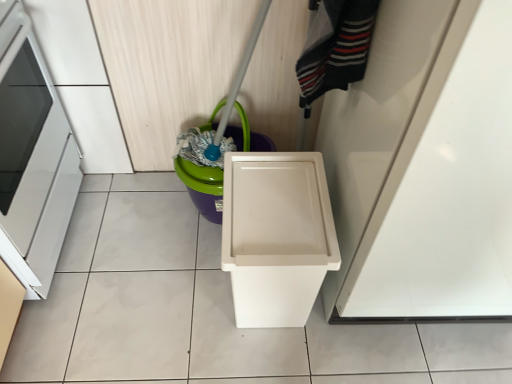
Identify the location of striped wool sweater at upper right. This screenshot has width=512, height=384. (335, 47).

What do you see at coordinates (34, 161) in the screenshot? I see `white glossy oven at left` at bounding box center [34, 161].

You are a GUI agent. You are given a task and a screenshot of the screen. Output one action in this format:
    pyautogui.click(x=<x>, y=<y>)
    Task: Click on the white glossy door at upper right
    This screenshot has width=512, height=384.
    Given the screenshot: What is the action you would take?
    pyautogui.click(x=424, y=166)

Is white glossy oven at left aimed at white glossy door at upper right?

Yes.

Considering the relative sizes of white glossy oven at left and white glossy door at upper right in the image provided, is white glossy oven at left shorter than white glossy door at upper right?

Indeed, white glossy oven at left has a lesser height compared to white glossy door at upper right.

I want to click on door lying above the white glossy oven at left (from the image's perspective), so click(424, 166).

Considering the relative sizes of white glossy oven at left and white plastic waste container at center in the image provided, is white glossy oven at left taller than white plastic waste container at center?

Correct, white glossy oven at left is much taller as white plastic waste container at center.

What's the angular difference between white glossy oven at left and white plastic waste container at center's facing directions?

The angular difference between white glossy oven at left and white plastic waste container at center is 90 degrees.

From a real-world perspective, is white glossy oven at left above or below white plastic waste container at center?

white glossy oven at left is above white plastic waste container at center.

From the image's perspective, is white glossy oven at left beneath white plastic waste container at center?

No, from the image's perspective, white glossy oven at left is not beneath white plastic waste container at center.

The height and width of the screenshot is (384, 512). I want to click on oven below the striped wool sweater at upper right (from the image's perspective), so click(x=34, y=161).

Is striped wool sweater at upper right aimed at white glossy oven at left?

No, striped wool sweater at upper right is not oriented towards white glossy oven at left.

Which object is further away from the camera taking this photo, striped wool sweater at upper right or white glossy oven at left?

white glossy oven at left.

Which of these two, striped wool sweater at upper right or white glossy oven at left, is wider?

white glossy oven at left.

From the image's perspective, is white plastic waste container at center beneath white glossy oven at left?

Correct, white plastic waste container at center appears lower than white glossy oven at left in the image.

In terms of width, does white plastic waste container at center look wider or thinner when compared to white glossy oven at left?

In the image, white plastic waste container at center appears to be more narrow than white glossy oven at left.

Is white plastic waste container at center oriented away from white glossy oven at left?

No, white plastic waste container at center is not facing the opposite direction of white glossy oven at left.

Which of these two, striped wool sweater at upper right or matte green plastic bucket at center, stands taller?

matte green plastic bucket at center is taller.

Could you tell me if striped wool sweater at upper right is turned towards matte green plastic bucket at center?

No, striped wool sweater at upper right is not turned towards matte green plastic bucket at center.

The height and width of the screenshot is (384, 512). Identify the location of clothing above the matte green plastic bucket at center (from a real-world perspective). (335, 47).

Between striped wool sweater at upper right and matte green plastic bucket at center, which one is positioned behind?

Positioned behind is matte green plastic bucket at center.

Does striped wool sweater at upper right turn towards white plastic waste container at center?

No, striped wool sweater at upper right is not facing towards white plastic waste container at center.

Which is behind, striped wool sweater at upper right or white plastic waste container at center?

Positioned behind is white plastic waste container at center.

From the image's perspective, is striped wool sweater at upper right located above or below white plastic waste container at center?

From the image's perspective, striped wool sweater at upper right appears above white plastic waste container at center.

Are striped wool sweater at upper right and white plastic waste container at center making contact?

striped wool sweater at upper right and white plastic waste container at center are clearly separated.

Is matte green plastic bucket at center outside of white glossy door at upper right?

matte green plastic bucket at center lies outside white glossy door at upper right's area.

From the image's perspective, is matte green plastic bucket at center under white glossy door at upper right?

Correct, matte green plastic bucket at center appears lower than white glossy door at upper right in the image.

Can you tell me how much matte green plastic bucket at center and white glossy door at upper right differ in facing direction?

The angular difference between matte green plastic bucket at center and white glossy door at upper right is 1.46e-05 degrees.

Which is less distant, (206, 184) or (480, 158)?

Point (206, 184).

This screenshot has width=512, height=384. In order to click on door above the white glossy oven at left (from the image's perspective) in this screenshot , I will do `click(424, 166)`.

Identify the location of oven on the left of white plastic waste container at center. (34, 161).

Considering their positions, is white glossy door at upper right positioned further to matte green plastic bucket at center than white plastic waste container at center?

white glossy door at upper right is further to matte green plastic bucket at center.

From the image, which object appears to be farther from white glossy oven at left, matte green plastic bucket at center or white plastic waste container at center?

white plastic waste container at center is positioned further to the anchor white glossy oven at left.

Looking at the image, which one is located further to white glossy door at upper right, white plastic waste container at center or striped wool sweater at upper right?

striped wool sweater at upper right lies further to white glossy door at upper right than the other object.

Estimate the real-world distances between objects in this image. Which object is closer to white plastic waste container at center, matte green plastic bucket at center or white glossy door at upper right?

white glossy door at upper right.

Estimate the real-world distances between objects in this image. Which object is further from white glossy door at upper right, white glossy oven at left or matte green plastic bucket at center?

white glossy oven at left is positioned further to the anchor white glossy door at upper right.

Considering their positions, is white plastic waste container at center positioned further to matte green plastic bucket at center than striped wool sweater at upper right?

striped wool sweater at upper right lies further to matte green plastic bucket at center than the other object.

Based on their spatial positions, is white glossy door at upper right or white plastic waste container at center further from white glossy oven at left?

Based on the image, white glossy door at upper right appears to be further to white glossy oven at left.

Which object lies further to the anchor point striped wool sweater at upper right, white glossy door at upper right or white glossy oven at left?

white glossy oven at left lies further to striped wool sweater at upper right than the other object.

Where is `potty that lies between striped wool sweater at upper right and white plastic waste container at center from top to bottom`? This screenshot has height=384, width=512. potty that lies between striped wool sweater at upper right and white plastic waste container at center from top to bottom is located at coordinates (202, 187).

This screenshot has height=384, width=512. I want to click on potty between white glossy oven at left and white glossy door at upper right from left to right, so click(x=202, y=187).

The image size is (512, 384). What are the coordinates of `clothing between white plastic waste container at center and white glossy door at upper right` in the screenshot? It's located at (335, 47).

The width and height of the screenshot is (512, 384). Identify the location of waste container between white glossy oven at left and white glossy door at upper right from left to right. (276, 236).